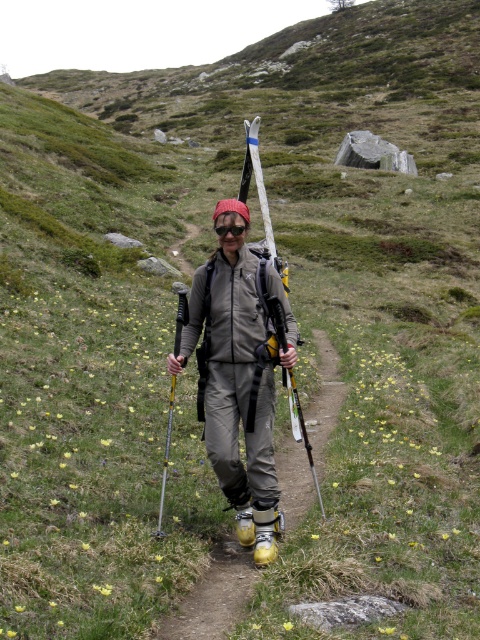
Can you confirm if matte gray ski suit at center is wider than white matte ski at center?

Incorrect, matte gray ski suit at center's width does not surpass white matte ski at center's.

Between matte gray ski suit at center and white matte ski at center, which one has less height?

With less height is matte gray ski suit at center.

Identify the location of matte gray ski suit at center. (237, 388).

Can you confirm if white matte ski at center is positioned to the right of transparent plastic goggles at center?

Indeed, white matte ski at center is positioned on the right side of transparent plastic goggles at center.

Does white matte ski at center have a lesser width compared to transparent plastic goggles at center?

Incorrect, white matte ski at center's width is not less than transparent plastic goggles at center's.

This screenshot has width=480, height=640. In order to click on white matte ski at center in this screenshot , I will do `click(260, 198)`.

Which is more to the right, matte gray ski suit at center or yellow metallic ski pole at center?

matte gray ski suit at center is more to the right.

What do you see at coordinates (237, 388) in the screenshot? I see `matte gray ski suit at center` at bounding box center [237, 388].

This screenshot has width=480, height=640. I want to click on matte gray ski suit at center, so click(x=237, y=388).